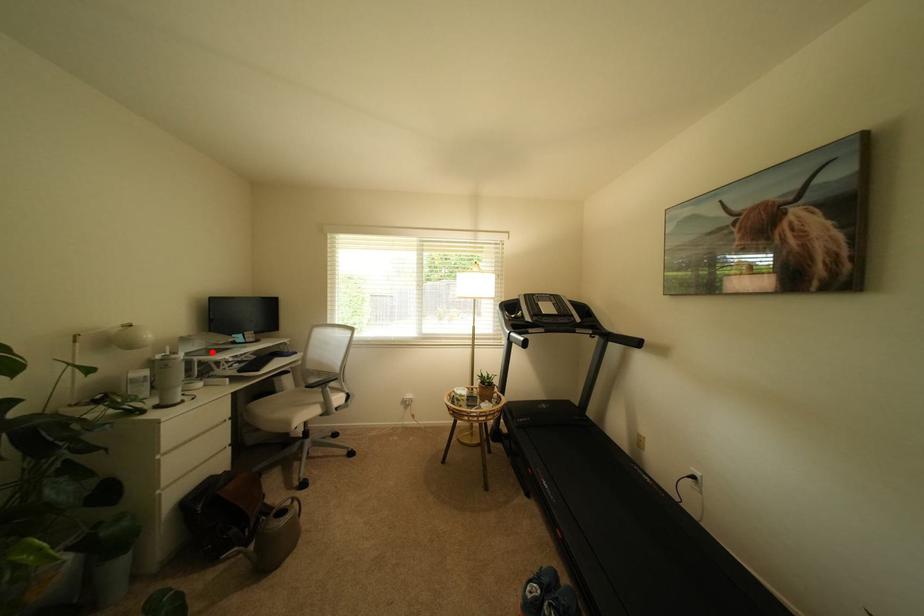
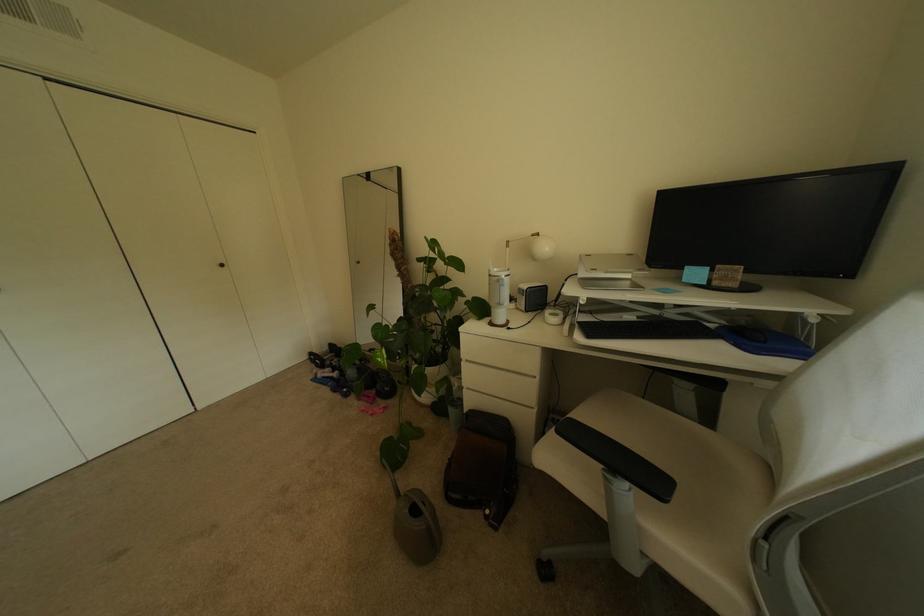
Find the pixel in the second image that matches the highlighted location in the first image.

(637, 284)